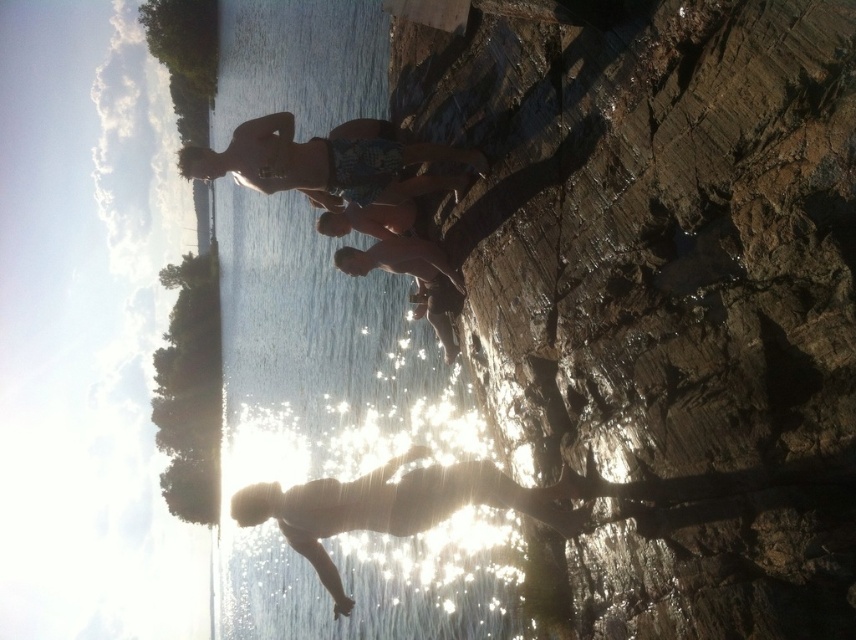
You are standing at the edge of the water and see two points in the scene. The first is point [821,532] and the second is point [282,116]. Which point is nearer to you?

Point [821,532] is closer to the viewer than point [282,116].